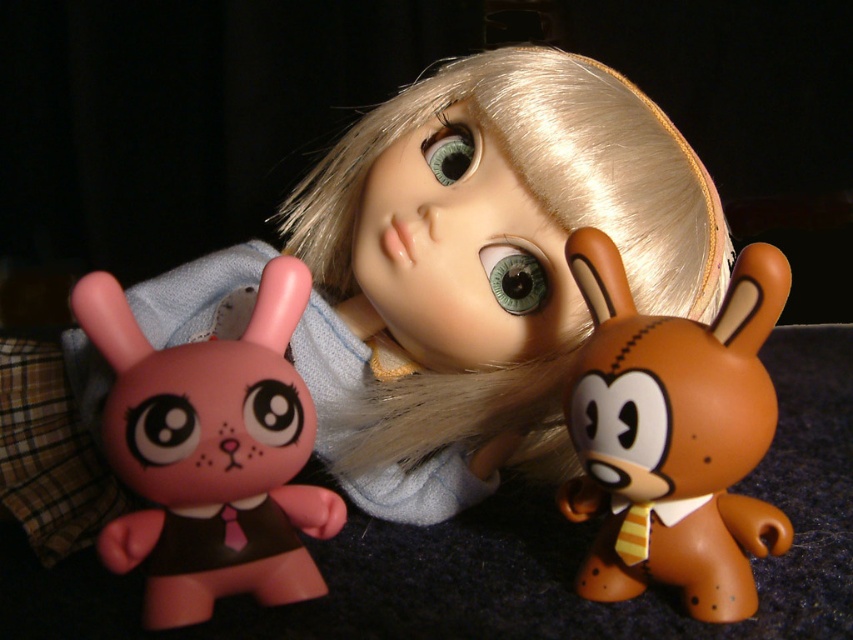
Question: Which point is farther from the camera taking this photo?

Choices:
 (A) (x=712, y=214)
 (B) (x=154, y=474)
 (C) (x=705, y=532)

Answer: (A)

Question: Which point is farther to the camera?

Choices:
 (A) matte plastic doll at center
 (B) matte pink plastic bunny at left

Answer: (A)

Question: Is matte plastic doll at center wider than brown matte plush toy at center?

Choices:
 (A) yes
 (B) no

Answer: (A)

Question: Based on their relative distances, which object is nearer to the brown matte plush toy at center?

Choices:
 (A) matte pink plastic bunny at left
 (B) matte plastic doll at center

Answer: (B)

Question: Observing the image, what is the correct spatial positioning of brown matte plush toy at center in reference to matte pink plastic bunny at left?

Choices:
 (A) below
 (B) above

Answer: (B)

Question: Is matte plastic doll at center wider than matte pink plastic bunny at left?

Choices:
 (A) no
 (B) yes

Answer: (B)